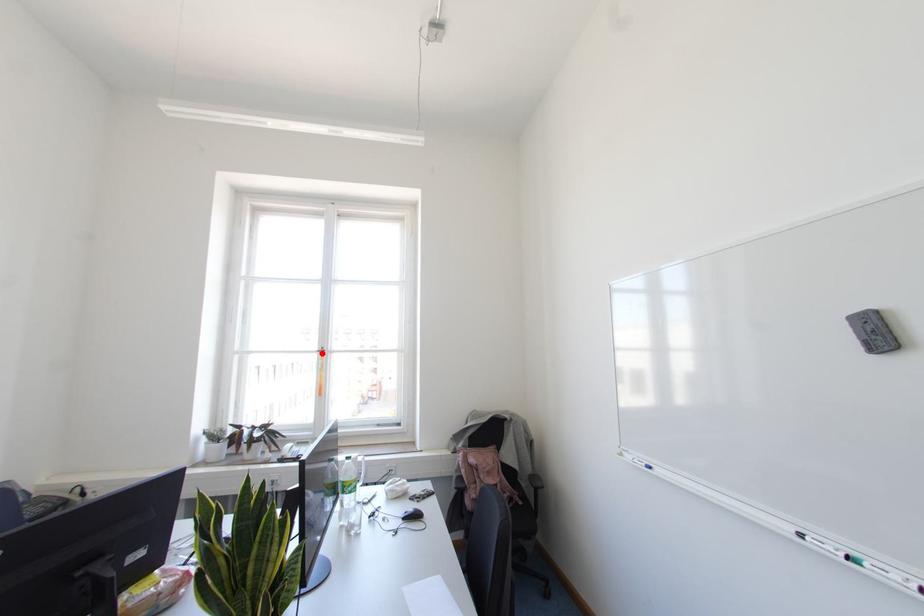
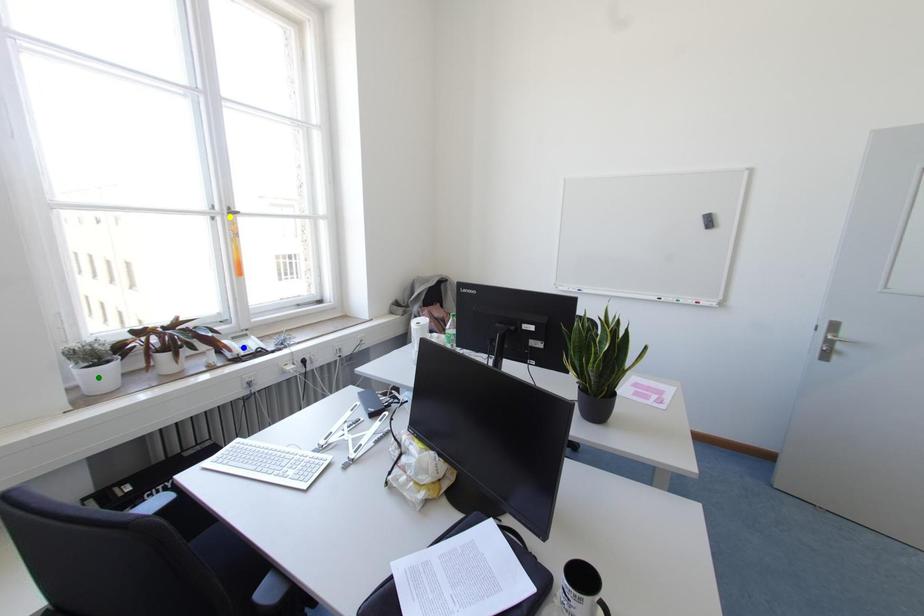
Question: I am providing you with two images of the same scene from different viewpoints. A red point is marked on the first image. You are given multiple points on the second image. Which point in image 2 represents the same 3d spot as the red point in image 1?

Choices:
 (A) green point
 (B) yellow point
 (C) blue point

Answer: (B)